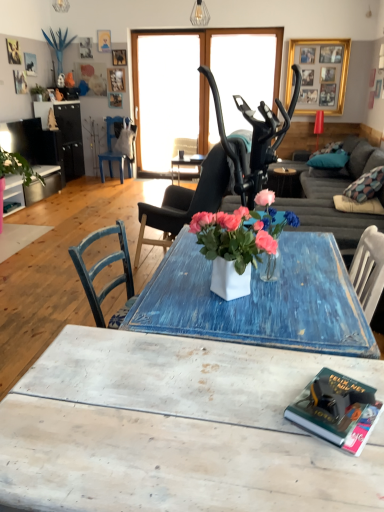
You are a GUI agent. You are given a task and a screenshot of the screen. Output one action in this format:
    pyautogui.click(x=<x>, y=<y>)
    Task: Click on the vacant region above hardcover book at lower right (from a real-world perspective)
    The image size is (384, 512).
    Given the screenshot: What is the action you would take?
    pyautogui.click(x=346, y=409)